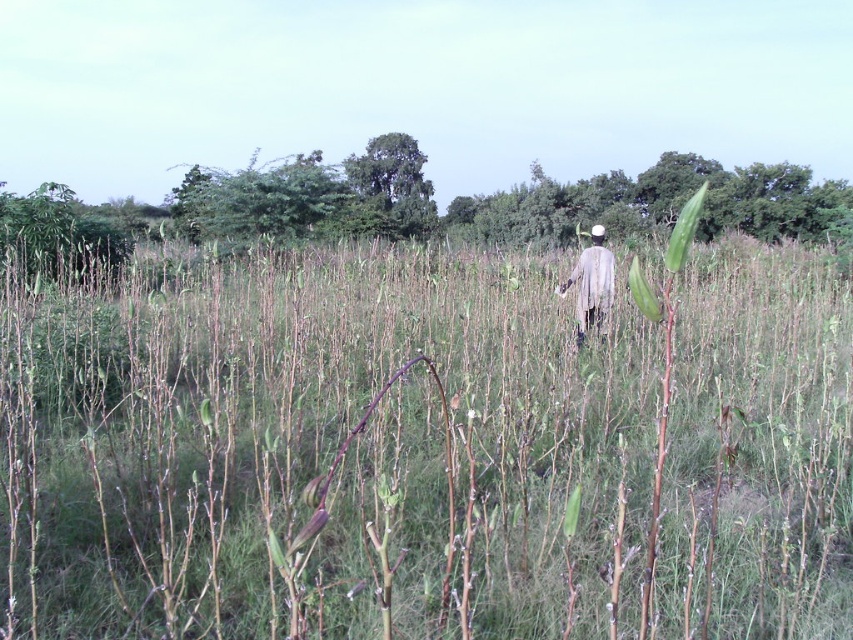
You are standing at the point marked by the coordinates point (422, 451) in the rural field scene. What type of surface are you currently standing on?

The point (422, 451) is on green matte grass at center, so you are standing on green matte grass.

You are a farmer standing in the field and notice the green matte grass at center and the light gray fabric at center. Which object is taller in this scene?

The light gray fabric at center is taller than the green matte grass at center.